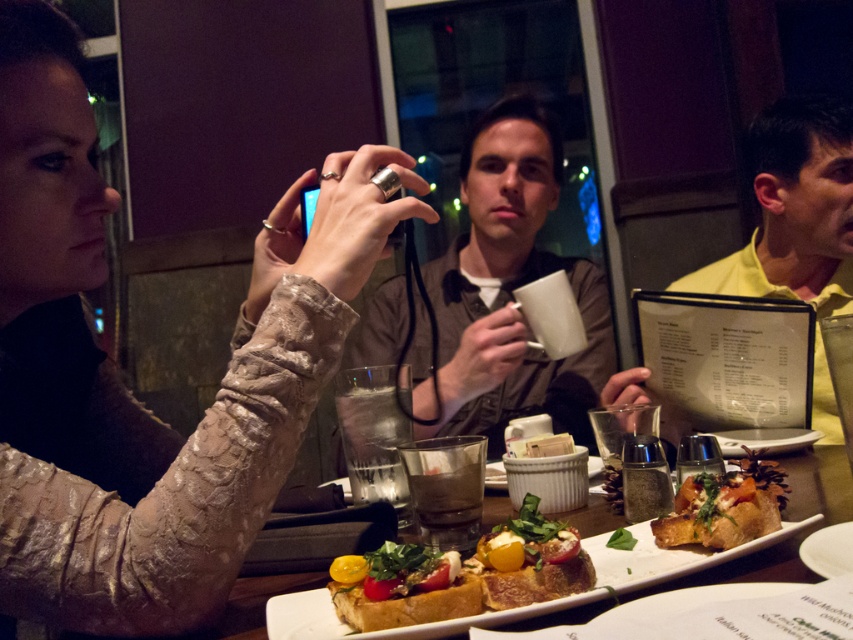
Question: Is golden crispy bread at center to the right of golden brown bread at center from the viewer's perspective?

Choices:
 (A) no
 (B) yes

Answer: (B)

Question: Which point is farther to the camera?

Choices:
 (A) (416, 493)
 (B) (589, 384)
 (C) (792, 248)
 (D) (349, 408)

Answer: (B)

Question: Is crusty bread with fresh toppings at center bigger than golden brown bread at center?

Choices:
 (A) no
 (B) yes

Answer: (A)

Question: Does matte gold ring at upper center appear over crusty bread with fresh toppings at center?

Choices:
 (A) yes
 (B) no

Answer: (A)

Question: Which object is positioned farthest from the golden brown bread at center?

Choices:
 (A) yellow fabric shirt at right
 (B) white ceramic plate at center

Answer: (A)

Question: Which point is closer to the camera?

Choices:
 (A) (767, 224)
 (B) (836, 452)
 (C) (32, 304)
 (D) (383, 394)

Answer: (C)